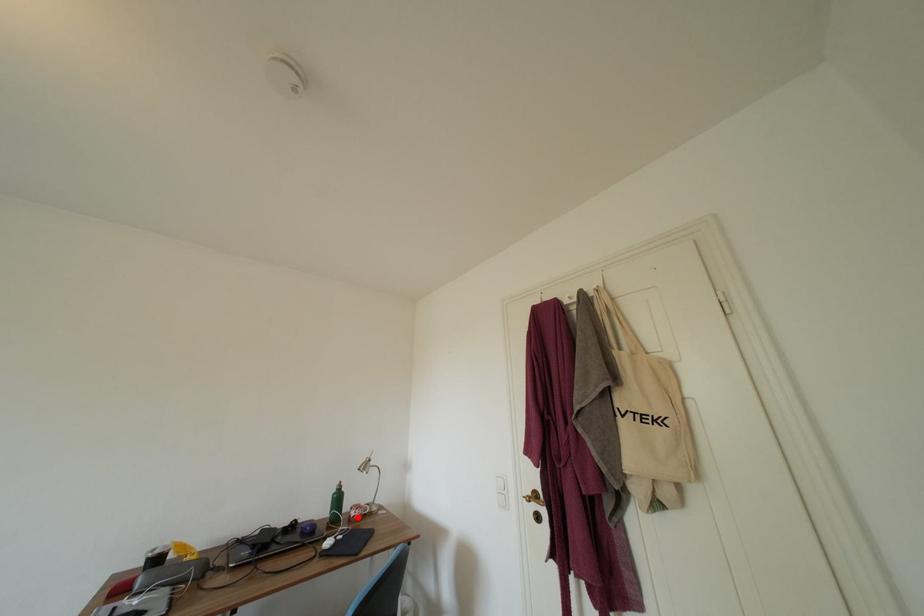
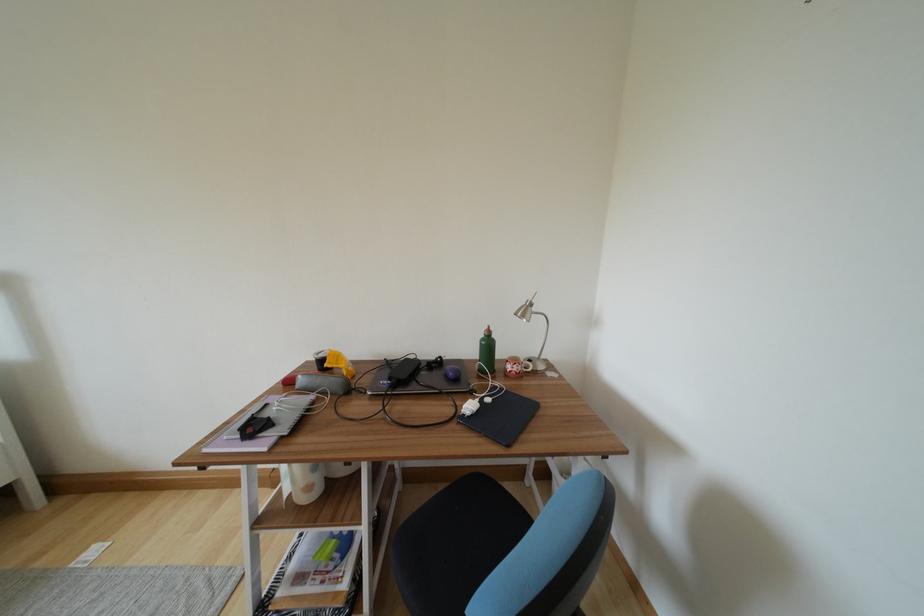
Where in the second image is the point corresponding to the highlighted location from the first image?

(514, 371)